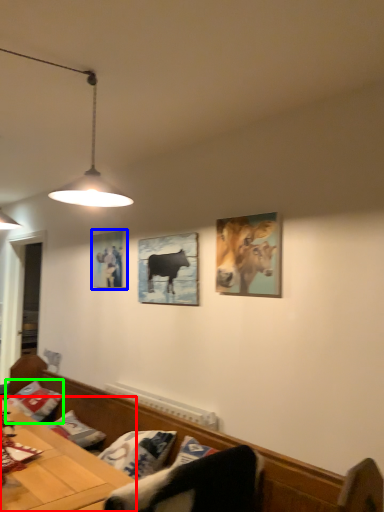
Question: Which object is positioned farthest from table (highlighted by a red box)? Select from picture frame (highlighted by a blue box) and pillow (highlighted by a green box).

Choices:
 (A) picture frame
 (B) pillow

Answer: (A)